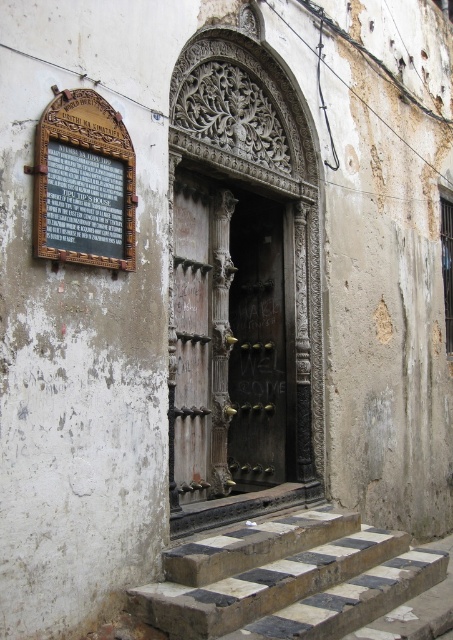
Question: Is wooden carved door at center to the left of checkerboard stone steps at center from the viewer's perspective?

Choices:
 (A) yes
 (B) no

Answer: (A)

Question: Which object is the farthest from the wooden carved door at center?

Choices:
 (A) checkerboard stone steps at center
 (B) wooden plaque at upper left
 (C) dark wood door at center

Answer: (B)

Question: Which object is positioned farthest from the wooden plaque at upper left?

Choices:
 (A) dark wood door at center
 (B) wooden carved door at center
 (C) checkerboard stone steps at center

Answer: (A)

Question: Which object is farther from the camera taking this photo?

Choices:
 (A) dark wood door at center
 (B) wooden carved door at center
 (C) checkerboard stone steps at center

Answer: (A)

Question: Does wooden carved door at center appear over dark wood door at center?

Choices:
 (A) yes
 (B) no

Answer: (A)

Question: Can you confirm if wooden carved door at center is wider than wooden plaque at upper left?

Choices:
 (A) yes
 (B) no

Answer: (A)